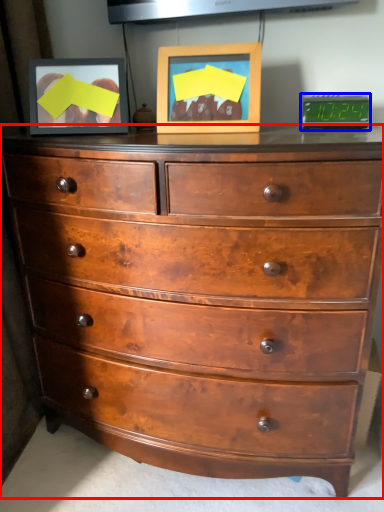
Question: Which object appears closest to the camera in this image, chest of drawers (highlighted by a red box) or alarm clock (highlighted by a blue box)?

Choices:
 (A) chest of drawers
 (B) alarm clock

Answer: (A)